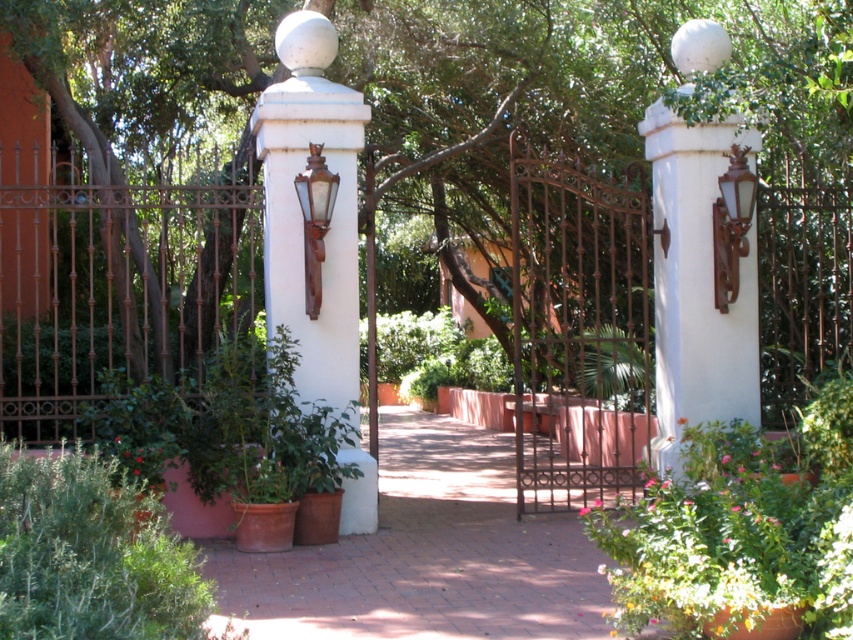
You are a gardener who needs to water the green fuzzy bush at lower left and the terracotta brick path at center. Which object should you water first if you want to start from the leftmost position?

The green fuzzy bush at lower left should be watered first because it is positioned to the left of the terracotta brick path at center.

You are standing at the entrance of the garden and want to walk straight ahead towards the gate. Which direction should you step onto the terracotta brick path at center to proceed forward?

The terracotta brick path at center is positioned at point 0.866 on the x axis and 0.502 on the y axis. Since the path is at center, stepping onto it will guide you straight ahead towards the gate.